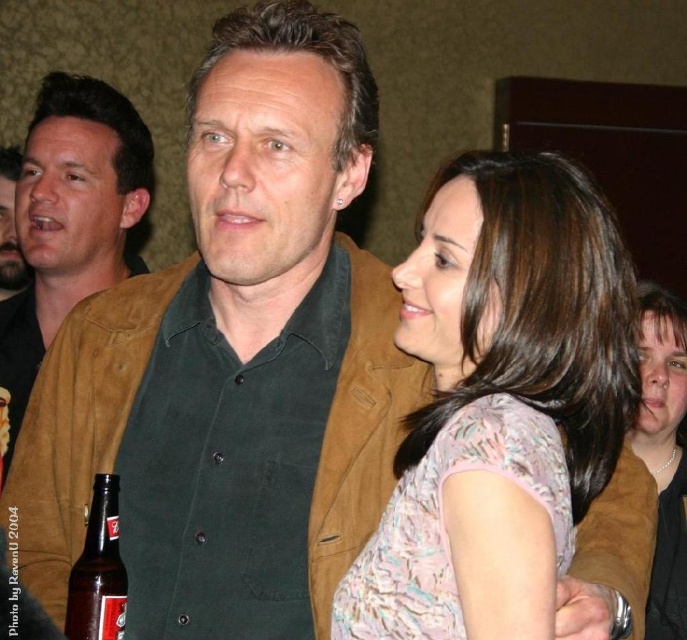
You are at a party and want to grab the brown glass bottle at lower left to get a drink. However, the brown leather jacket at center is blocking your path. Can you reach the bottle without moving the jacket?

The brown glass bottle at lower left is behind the brown leather jacket at center, so you can reach it without moving the jacket since it is positioned behind it.

You are at a party and need to decide which item to hand over first between the brown leather jacket at center and the matte pink blouse at center. Since you can only carry one at a time, which one should you choose if you want to carry the larger item first?

The brown leather jacket at center is bigger than the matte pink blouse at center, so you should choose the brown leather jacket at center first.